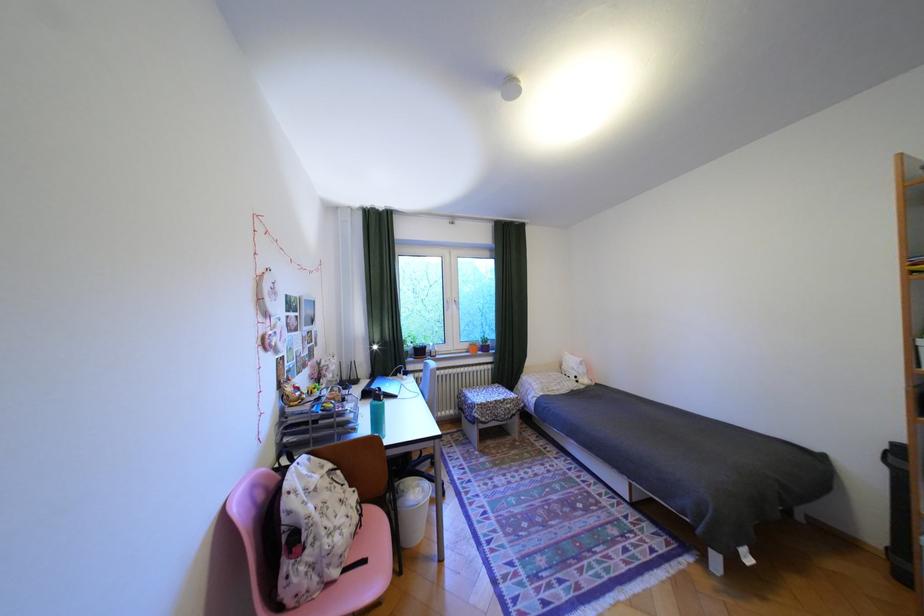
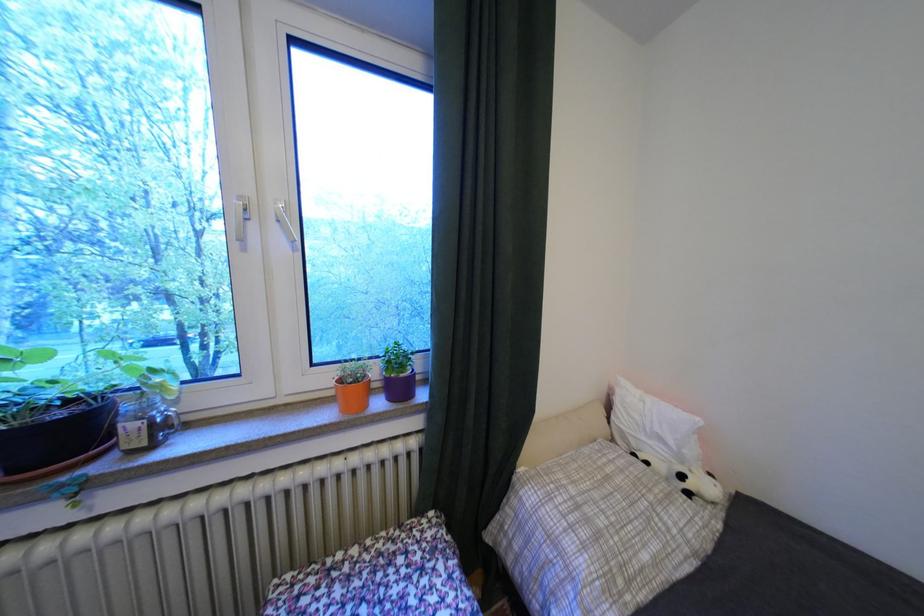
Find the pixel in the second image that matches point (569, 390) in the first image.

(667, 562)